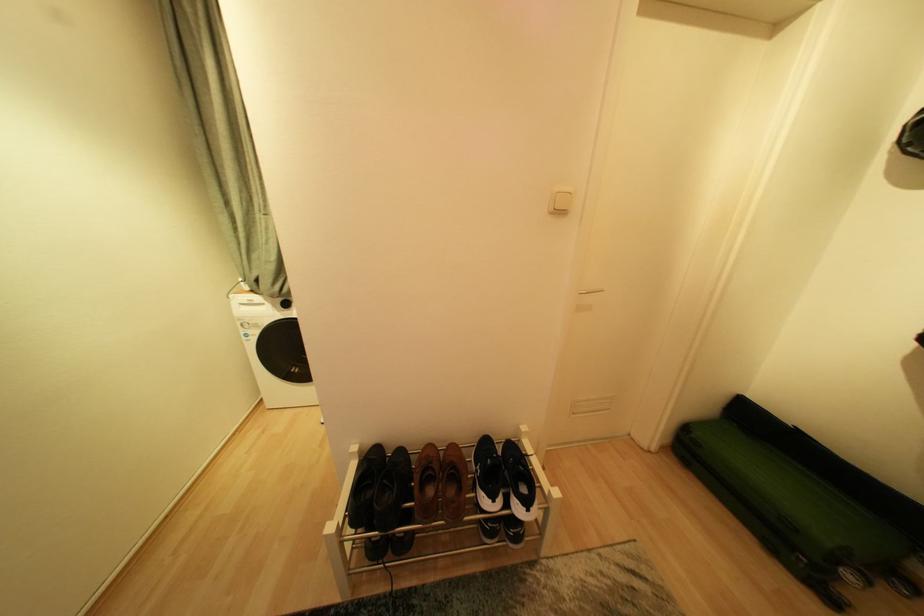
Find where to push the white light switch. Please return your answer as a coordinate pair (x, y).

(561, 201)